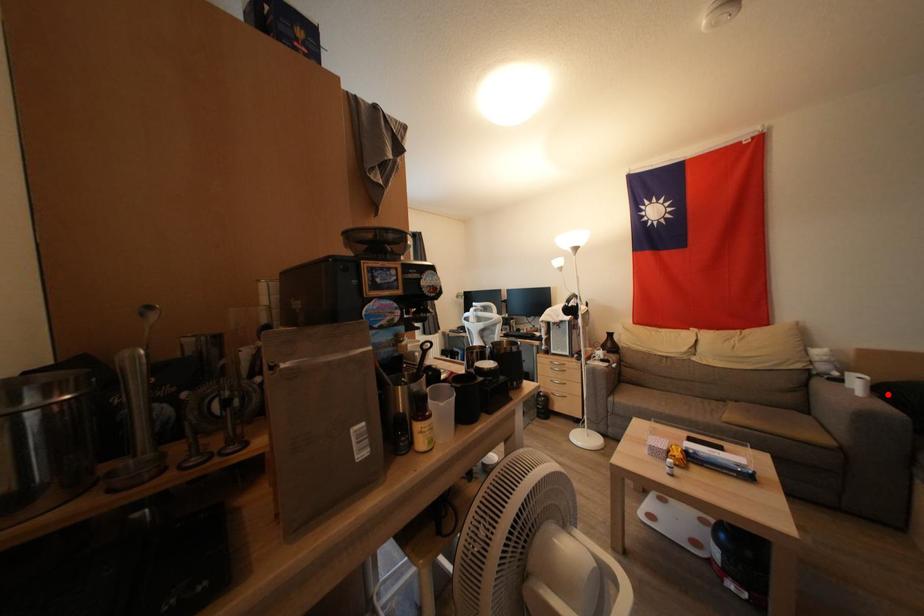
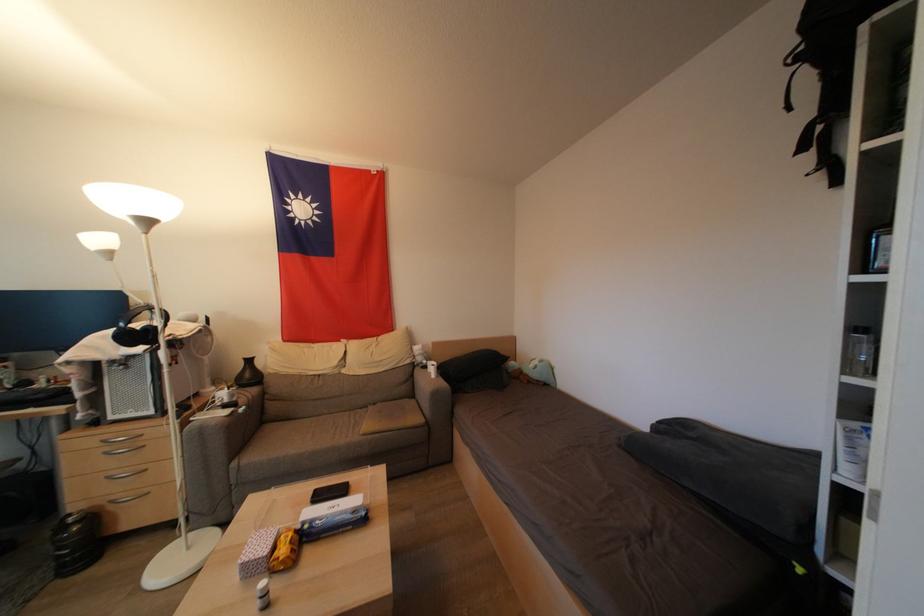
Locate, in the second image, the point that corresponds to the highlighted location in the first image.

(445, 373)